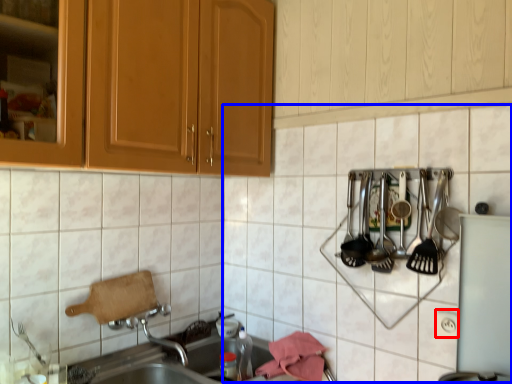
Question: Which object is further to the camera taking this photo, electric outlet (highlighted by a red box) or tile (highlighted by a blue box)?

Choices:
 (A) electric outlet
 (B) tile

Answer: (A)